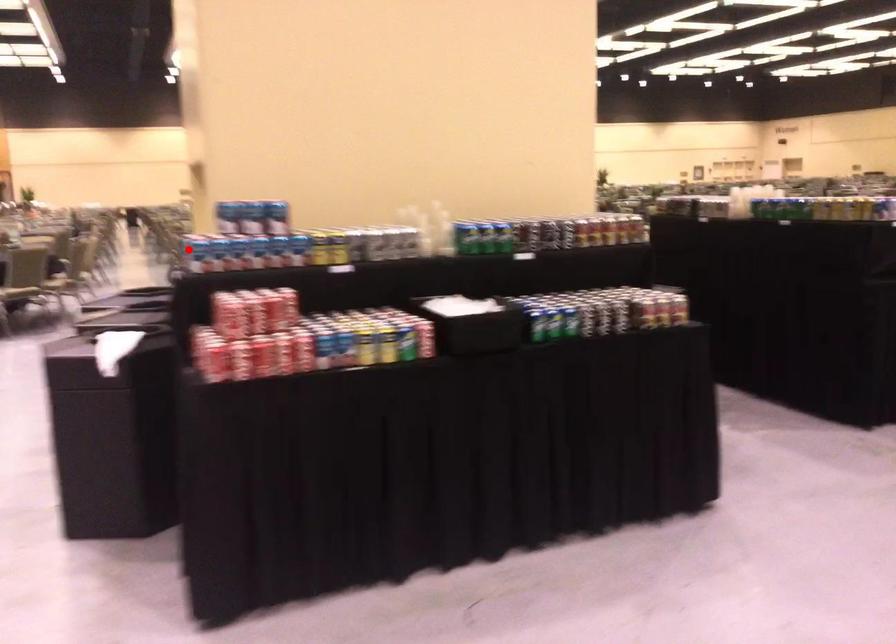
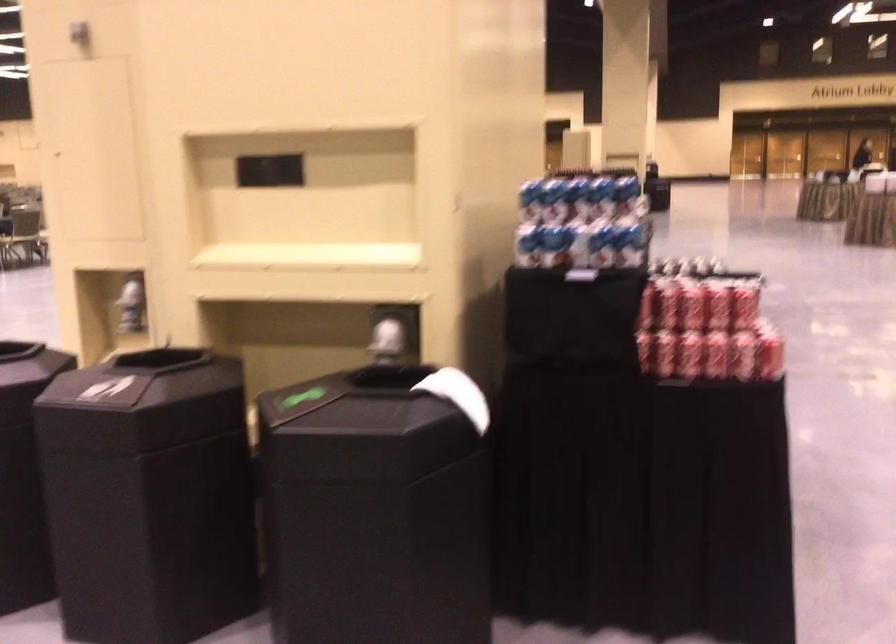
Question: I am providing you with two images of the same scene from different viewpoints. Given a red point in image1, look at the same physical point in image2. Is it:

Choices:
 (A) Closer to the viewpoint
 (B) Farther from the viewpoint

Answer: (A)